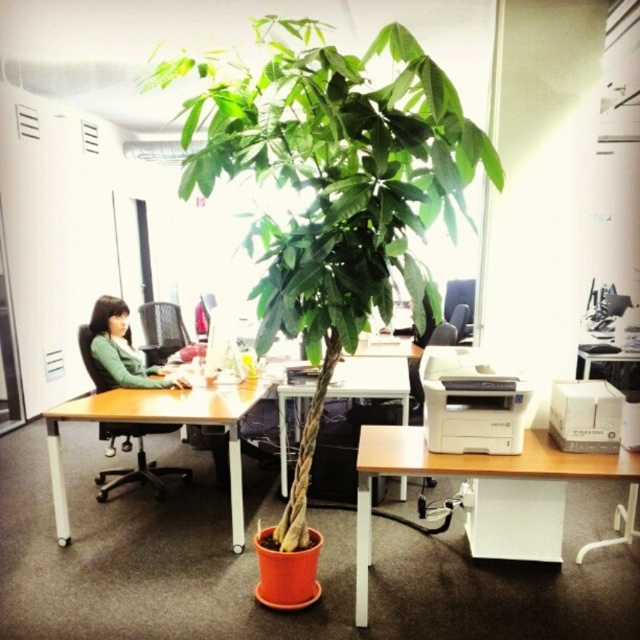
You are an office worker who needs to print a document. You see the white plastic printer at lower center and the white matte printer at right. Which printer is closer to you?

The white plastic printer at lower center is closer to you because it is in front of the white matte printer at right.

You are organizing an office event and need to place a 1.2 meter wide banner between the wooden table at center and the white matte printer at right. Can the banner fit between them based on their sizes?

The wooden table at center is wider than the white matte printer at right. However, the banner requires a space of 1.2 meters. Without specific measurements of the distance between them, we cannot confirm if the banner will fit. The question only provides information about their widths, not the space between them.

You need to place a new laptop on the wooden table at center and the white matte printer at right. Which surface can accommodate the laptop better based on their sizes?

The wooden table at center has a larger size compared to the white matte printer at right, so the wooden table at center can accommodate the laptop better.